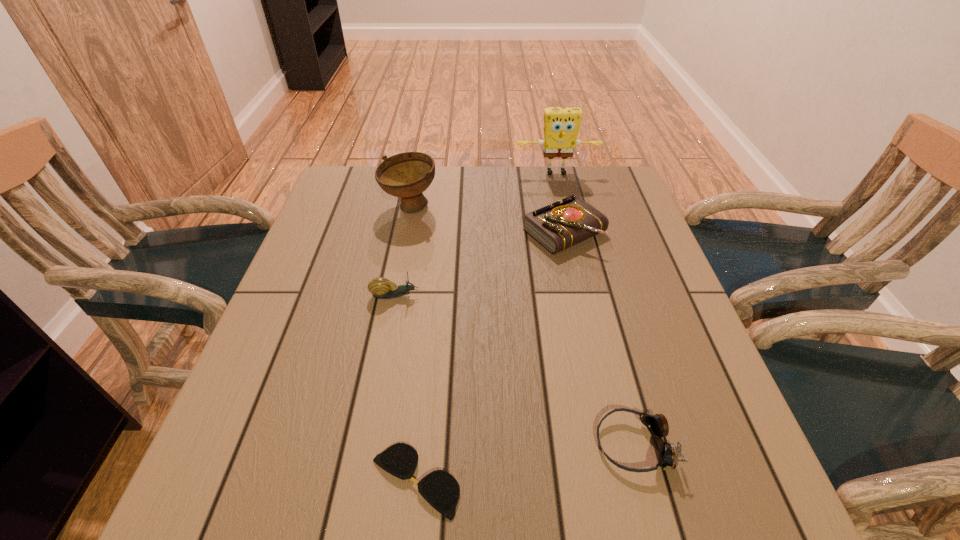
Where is `free space at the near left corner`? free space at the near left corner is located at coordinates (255, 526).

Identify the location of free space that is in between the fourth farthest object and the shortest object. The width and height of the screenshot is (960, 540). (405, 388).

Locate an element on the screen. vacant area between the fifth tallest object and the soup bowl is located at coordinates (522, 326).

Find the location of a particular element. Image resolution: width=960 pixels, height=540 pixels. vacant area that lies between the goggles and the second tallest object is located at coordinates (522, 326).

What are the coordinates of `empty location between the diary and the second shortest object` in the screenshot? It's located at (599, 338).

Locate an element on the screen. This screenshot has width=960, height=540. vacant area that lies between the spectacles and the diary is located at coordinates click(x=490, y=356).

Locate an element on the screen. free space between the second shortest object and the escargot is located at coordinates (515, 370).

Where is `empty location between the diary and the third nearest object`? This screenshot has width=960, height=540. empty location between the diary and the third nearest object is located at coordinates (480, 264).

You are a GUI agent. You are given a task and a screenshot of the screen. Output one action in this format:
    pyautogui.click(x=<x>, y=<y>)
    Task: Click on the vacant area that lies between the sponge and the escargot
    Image resolution: width=960 pixels, height=540 pixels.
    Given the screenshot: What is the action you would take?
    pyautogui.click(x=475, y=234)

At what (x,y) coordinates should I click in order to perform the action: click on vacant space in between the fifth shortest object and the spectacles. Please return your answer as a coordinate pair (x, y). The width and height of the screenshot is (960, 540). Looking at the image, I should click on (413, 344).